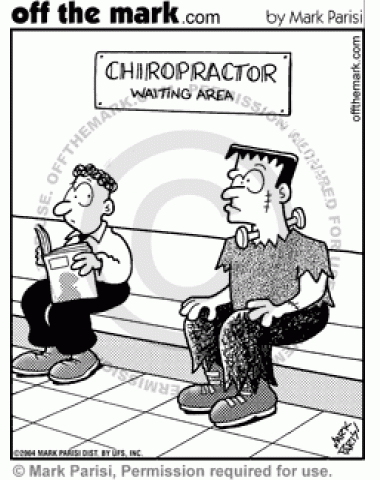
Where is `bench`? This screenshot has width=380, height=480. bench is located at coordinates (173, 263).